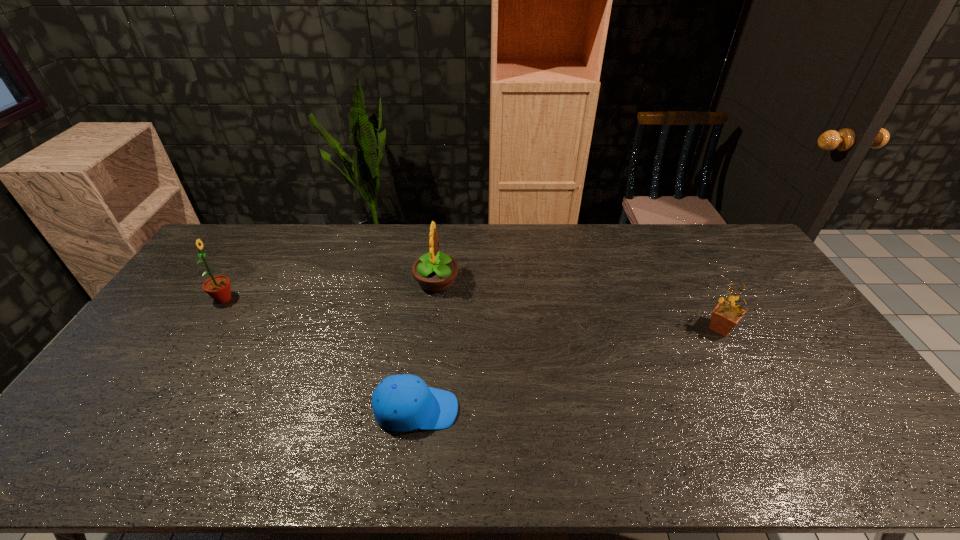
Find the location of a particular element. the leftmost object is located at coordinates (218, 287).

Locate an element on the screen. This screenshot has height=540, width=960. the second sunflower from left to right is located at coordinates (435, 272).

Where is `the rightmost sunflower`? This screenshot has height=540, width=960. the rightmost sunflower is located at coordinates click(725, 316).

The image size is (960, 540). I want to click on the second shortest object, so click(x=725, y=316).

At what (x,y) coordinates should I click in order to perform the action: click on the shortest object. Please return your answer as a coordinate pair (x, y). The width and height of the screenshot is (960, 540). Looking at the image, I should click on (401, 403).

Image resolution: width=960 pixels, height=540 pixels. I want to click on cap, so click(x=401, y=403).

Identify the location of vacant space located 0.300m on the face of the leftmost sunflower. This screenshot has width=960, height=540. (328, 299).

Find the location of `free space located on the face of the second sunflower from left to right`. free space located on the face of the second sunflower from left to right is located at coordinates (509, 282).

Locate an element on the screen. This screenshot has width=960, height=540. blank space located at the front of the rightmost sunflower with flowers visible is located at coordinates (583, 328).

Locate an element on the screen. The image size is (960, 540). free spot located at the front of the rightmost sunflower with flowers visible is located at coordinates (668, 328).